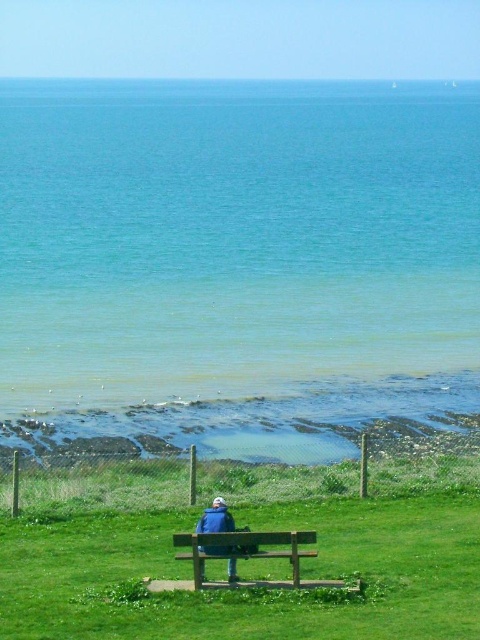
You are standing at the edge of the grassy area near the chain link fence and want to sit down on the brown wooden bench at center. Which direction should you move to reach it from the blue fabric jacket at center?

The brown wooden bench at center is positioned on the right side of the blue fabric jacket at center, so you should move to the right to reach it.

You are standing at the point closer to the camera between point (222,548) and point (208,532). Which point are you at?

You are at point (222,548) because it is closer to the viewer than point (208,532).